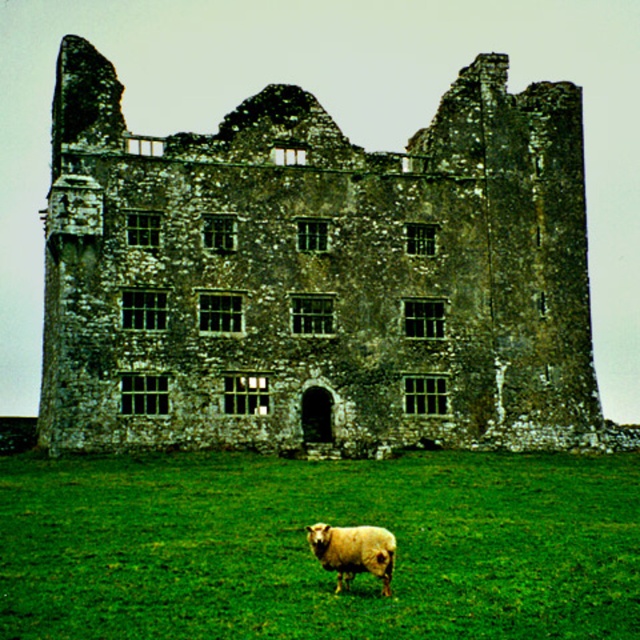
Question: Can you confirm if green grass at lower center is positioned below white woolly sheep at lower center?

Choices:
 (A) no
 (B) yes

Answer: (A)

Question: Which of the following is the closest to the observer?

Choices:
 (A) (328, 552)
 (B) (483, 124)
 (C) (132, 595)

Answer: (C)

Question: Which point appears farthest from the camera in this image?

Choices:
 (A) (76, 310)
 (B) (346, 529)

Answer: (A)

Question: Does rusty stone castle at center appear under white woolly sheep at lower center?

Choices:
 (A) no
 (B) yes

Answer: (A)

Question: Does rusty stone castle at center have a smaller size compared to green grass at lower center?

Choices:
 (A) no
 (B) yes

Answer: (A)

Question: Which is farther from the white woolly sheep at lower center?

Choices:
 (A) green grass at lower center
 (B) rusty stone castle at center

Answer: (B)